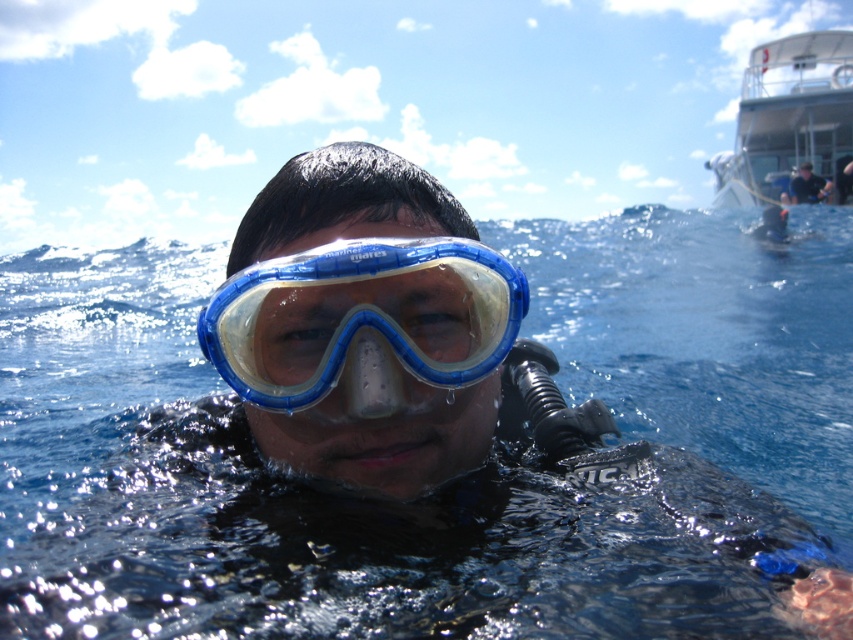
Question: Is transparent plastic goggles at center further to camera compared to dark blue fabric shirt at upper right?

Choices:
 (A) no
 (B) yes

Answer: (A)

Question: Which object appears closest to the camera in this image?

Choices:
 (A) transparent blue water at center
 (B) transparent plastic goggles at center
 (C) dark blue fabric shirt at upper right
 (D) white glossy boat at upper right

Answer: (A)

Question: Does transparent plastic goggles at center appear on the right side of dark blue fabric shirt at upper right?

Choices:
 (A) no
 (B) yes

Answer: (A)

Question: Estimate the real-world distances between objects in this image. Which object is farther from the white glossy boat at upper right?

Choices:
 (A) transparent blue water at center
 (B) dark blue fabric shirt at upper right

Answer: (A)

Question: Can you confirm if transparent blue water at center is positioned to the left of white glossy boat at upper right?

Choices:
 (A) yes
 (B) no

Answer: (A)

Question: Which point is farther to the camera?

Choices:
 (A) transparent blue water at center
 (B) white glossy boat at upper right

Answer: (B)